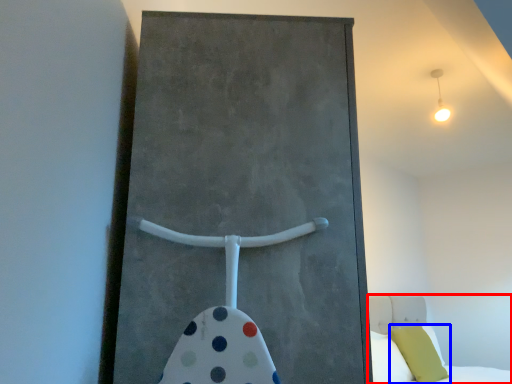
Question: Which point is further to the camera, bed (highlighted by a red box) or pillow (highlighted by a blue box)?

Choices:
 (A) bed
 (B) pillow

Answer: (B)